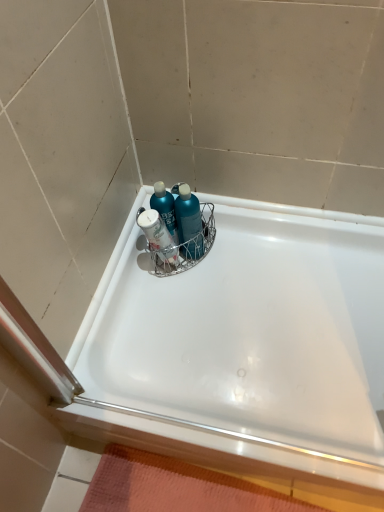
Find the location of a particular element. The height and width of the screenshot is (512, 384). vacant space to the right of teal plastic bottles at center, the 2th cleaning product viewed from the left is located at coordinates (250, 246).